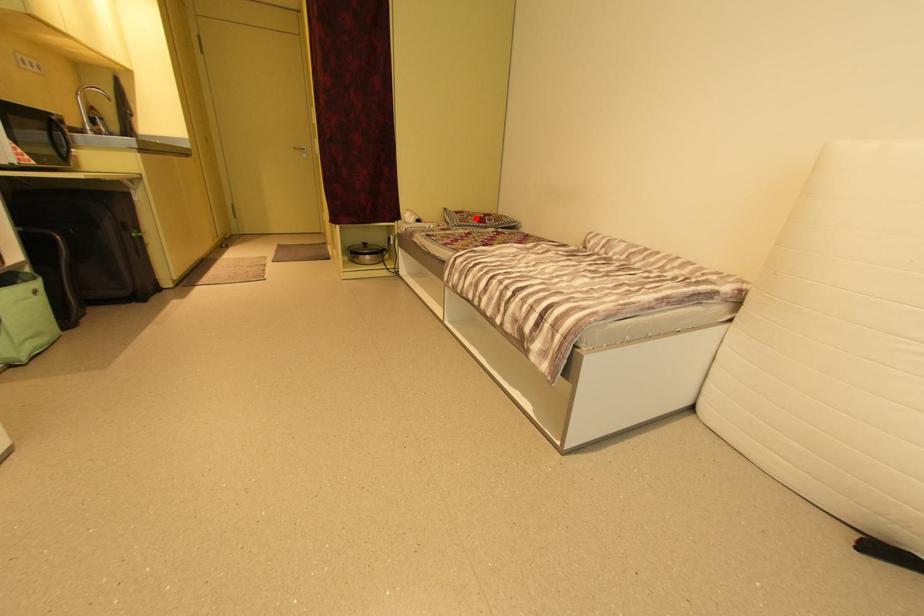
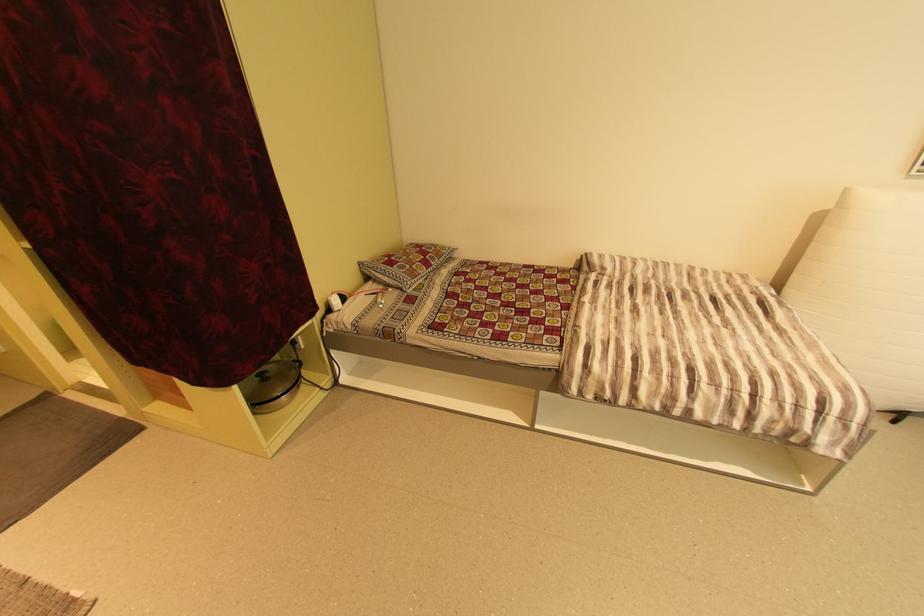
Locate, in the second image, the point that corresponds to the highlighted location in the first image.

(420, 267)